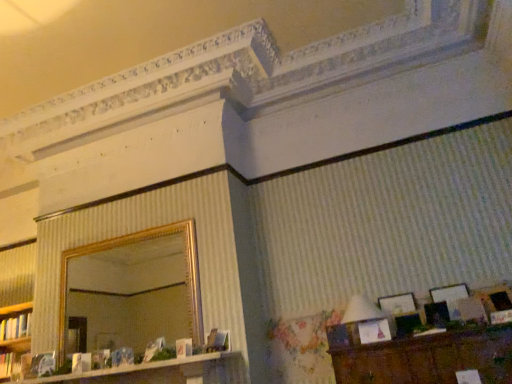
How much space does matte silver picture frame at upper right, which appears as the 1th picture frame when viewed from the left, occupy vertically?

The height of matte silver picture frame at upper right, which appears as the 1th picture frame when viewed from the left, is 28.99 centimeters.

Image resolution: width=512 pixels, height=384 pixels. In order to click on matte silver picture frame at upper right, acting as the third picture frame starting from the right in this screenshot , I will do `click(398, 304)`.

This screenshot has height=384, width=512. What do you see at coordinates (14, 365) in the screenshot? I see `matte white book at lower left, which appears as the 1th book when ordered from the bottom` at bounding box center [14, 365].

What do you see at coordinates (450, 297) in the screenshot?
I see `matte black picture frame at lower right, arranged as the 2th picture frame when viewed from the right` at bounding box center [450, 297].

The image size is (512, 384). In order to click on white paper book at left, which is the 2th book in bottom-to-top order in this screenshot , I will do `click(15, 327)`.

Between matte black picture frame at lower right, arranged as the 2th picture frame when viewed from the left, and white glossy dresser at lower left, which one appears on the right side from the viewer's perspective?

matte black picture frame at lower right, arranged as the 2th picture frame when viewed from the left, is more to the right.

Is matte black picture frame at lower right, arranged as the 2th picture frame when viewed from the right, aimed at white glossy dresser at lower left?

No.

How different are the orientations of matte black picture frame at lower right, arranged as the 2th picture frame when viewed from the right, and white glossy dresser at lower left in degrees?

There is a 1.01-degree angle between the facing directions of matte black picture frame at lower right, arranged as the 2th picture frame when viewed from the right, and white glossy dresser at lower left.

Locate an element on the screen. The height and width of the screenshot is (384, 512). the 2nd picture frame above when counting from the white glossy dresser at lower left (from the image's perspective) is located at coordinates (450, 297).

From a real-world perspective, is brown wooden vanity at lower right physically located above or below white fabric lampshade at right?

brown wooden vanity at lower right is below white fabric lampshade at right.

Is point (426, 383) positioned after point (350, 335)?

No.

Does brown wooden vanity at lower right appear on the left side of white fabric lampshade at right?

Incorrect, brown wooden vanity at lower right is not on the left side of white fabric lampshade at right.

Considering the relative sizes of brown wooden vanity at lower right and white fabric lampshade at right in the image provided, is brown wooden vanity at lower right taller than white fabric lampshade at right?

Yes, brown wooden vanity at lower right is taller than white fabric lampshade at right.

Relative to matte black picture frame at lower right, arranged as the 2th picture frame when viewed from the left, is matte white book at lower left, the 2th book from the top, in front or behind?

Clearly, matte white book at lower left, the 2th book from the top, is behind matte black picture frame at lower right, arranged as the 2th picture frame when viewed from the left.

Considering the positions of objects matte white book at lower left, the 2th book from the top, and matte black picture frame at lower right, arranged as the 2th picture frame when viewed from the left, in the image provided, who is more to the left, matte white book at lower left, the 2th book from the top, or matte black picture frame at lower right, arranged as the 2th picture frame when viewed from the left,?

matte white book at lower left, the 2th book from the top, is more to the left.

Is matte black picture frame at lower right, arranged as the 2th picture frame when viewed from the left, surrounded by matte white book at lower left, the 2th book from the top?

Definitely not — matte black picture frame at lower right, arranged as the 2th picture frame when viewed from the left, is not inside matte white book at lower left, the 2th book from the top.

Does point (4, 357) come closer to viewer compared to point (463, 287)?

No, it is behind (463, 287).

Which object is positioned more to the left, white glossy dresser at lower left or matte white book at lower left, which appears as the 1th book when ordered from the bottom?

matte white book at lower left, which appears as the 1th book when ordered from the bottom.

Is white glossy dresser at lower left closer to camera compared to matte white book at lower left, which appears as the 1th book when ordered from the bottom?

Yes, white glossy dresser at lower left is in front of matte white book at lower left, which appears as the 1th book when ordered from the bottom.

Between white glossy dresser at lower left and matte white book at lower left, the 2th book from the top, which one has smaller size?

Smaller between the two is matte white book at lower left, the 2th book from the top.

Could you tell me if white fabric lampshade at right is turned towards matte black picture frame at lower right, arranged as the 2th picture frame when viewed from the right?

No.

Is white fabric lampshade at right far from matte black picture frame at lower right, arranged as the 2th picture frame when viewed from the left?

No, there isn't a large distance between white fabric lampshade at right and matte black picture frame at lower right, arranged as the 2th picture frame when viewed from the left.

From the image's perspective, is white fabric lampshade at right beneath matte black picture frame at lower right, arranged as the 2th picture frame when viewed from the left?

Yes, from the image's perspective, white fabric lampshade at right is below matte black picture frame at lower right, arranged as the 2th picture frame when viewed from the left.

In the image, is white fabric lampshade at right positioned in front of or behind matte black picture frame at lower right, arranged as the 2th picture frame when viewed from the left?

white fabric lampshade at right is in front of matte black picture frame at lower right, arranged as the 2th picture frame when viewed from the left.

Between wooden picture frame at lower right, arranged as the 3th picture frame when viewed from the left, and gold-framed mirror at upper center, which one has smaller size?

wooden picture frame at lower right, arranged as the 3th picture frame when viewed from the left, is smaller.

From the picture: From the image's perspective, which object appears higher, wooden picture frame at lower right, arranged as the 3th picture frame when viewed from the left, or gold-framed mirror at upper center?

wooden picture frame at lower right, arranged as the 3th picture frame when viewed from the left.

Is gold-framed mirror at upper center at the back of wooden picture frame at lower right, positioned as the first picture frame in right-to-left order?

No, gold-framed mirror at upper center is not at the back of wooden picture frame at lower right, positioned as the first picture frame in right-to-left order.

Would you consider wooden picture frame at lower right, positioned as the first picture frame in right-to-left order, to be distant from gold-framed mirror at upper center?

wooden picture frame at lower right, positioned as the first picture frame in right-to-left order, is far away from gold-framed mirror at upper center.

Between point (8, 329) and point (501, 289), which one is positioned behind?

The point (8, 329) is farther.

Does white paper book at left, the first book in the top-to-bottom sequence, have a greater height compared to wooden picture frame at lower right, arranged as the 3th picture frame when viewed from the left?

In fact, white paper book at left, the first book in the top-to-bottom sequence, may be shorter than wooden picture frame at lower right, arranged as the 3th picture frame when viewed from the left.

From a real-world perspective, which is physically above, white paper book at left, the first book in the top-to-bottom sequence, or wooden picture frame at lower right, arranged as the 3th picture frame when viewed from the left?

white paper book at left, the first book in the top-to-bottom sequence, is physically above.

At what (x,y) coordinates should I click in order to perform the action: click on the 3rd picture frame counting from the right of the white paper book at left, the first book in the top-to-bottom sequence. Please return your answer as a coordinate pair (x, y). Looking at the image, I should click on (495, 299).

Find the location of `dresser that appears below the matte black picture frame at lower right, arranged as the 2th picture frame when viewed from the right (from the image's perspective)`. dresser that appears below the matte black picture frame at lower right, arranged as the 2th picture frame when viewed from the right (from the image's perspective) is located at coordinates (140, 368).

This screenshot has height=384, width=512. What are the coordinates of `table lamp on the left side of brown wooden vanity at lower right` in the screenshot? It's located at (360, 314).

From the image, which object appears to be nearer to white glossy dresser at lower left, white paper book at left, which is the 2th book in bottom-to-top order, or matte silver picture frame at upper right, acting as the third picture frame starting from the right?

white paper book at left, which is the 2th book in bottom-to-top order, is closer to white glossy dresser at lower left.

When comparing their distances from matte white book at lower left, the 2th book from the top, does white glossy dresser at lower left or matte black picture frame at lower right, arranged as the 2th picture frame when viewed from the left, seem further?

Based on the image, matte black picture frame at lower right, arranged as the 2th picture frame when viewed from the left, appears to be further to matte white book at lower left, the 2th book from the top.

Looking at the image, which one is located closer to gold-framed mirror at upper center, matte silver picture frame at upper right, which appears as the 1th picture frame when viewed from the left, or matte black picture frame at lower right, arranged as the 2th picture frame when viewed from the left?

matte silver picture frame at upper right, which appears as the 1th picture frame when viewed from the left, lies closer to gold-framed mirror at upper center than the other object.

From the image, which object appears to be farther from matte silver picture frame at upper right, which appears as the 1th picture frame when viewed from the left, matte black picture frame at lower right, arranged as the 2th picture frame when viewed from the left, or white paper book at left, which is the 2th book in bottom-to-top order?

white paper book at left, which is the 2th book in bottom-to-top order, lies further to matte silver picture frame at upper right, which appears as the 1th picture frame when viewed from the left, than the other object.

Based on their spatial positions, is matte silver picture frame at upper right, which appears as the 1th picture frame when viewed from the left, or white glossy dresser at lower left closer to brown wooden vanity at lower right?

matte silver picture frame at upper right, which appears as the 1th picture frame when viewed from the left, lies closer to brown wooden vanity at lower right than the other object.

Considering their positions, is wooden picture frame at lower right, arranged as the 3th picture frame when viewed from the left, positioned closer to white glossy dresser at lower left than gold-framed mirror at upper center?

Based on the image, gold-framed mirror at upper center appears to be nearer to white glossy dresser at lower left.

When comparing their distances from wooden picture frame at lower right, positioned as the first picture frame in right-to-left order, does matte white book at lower left, the 2th book from the top, or white paper book at left, which is the 2th book in bottom-to-top order, seem closer?

matte white book at lower left, the 2th book from the top.

Considering their positions, is matte black picture frame at lower right, arranged as the 2th picture frame when viewed from the right, positioned further to matte white book at lower left, which appears as the 1th book when ordered from the bottom, than white fabric lampshade at right?

The object further to matte white book at lower left, which appears as the 1th book when ordered from the bottom, is matte black picture frame at lower right, arranged as the 2th picture frame when viewed from the right.

Identify the location of table lamp between white paper book at left, which is the 2th book in bottom-to-top order, and matte black picture frame at lower right, arranged as the 2th picture frame when viewed from the right, from left to right. The height and width of the screenshot is (384, 512). (360, 314).

Locate an element on the screen. The image size is (512, 384). vanity between matte white book at lower left, the 2th book from the top, and matte black picture frame at lower right, arranged as the 2th picture frame when viewed from the left, in the horizontal direction is located at coordinates (428, 358).

This screenshot has width=512, height=384. In order to click on picture frame between white glossy dresser at lower left and matte black picture frame at lower right, arranged as the 2th picture frame when viewed from the left in this screenshot , I will do `click(398, 304)`.

This screenshot has height=384, width=512. In order to click on picture frame situated between gold-framed mirror at upper center and matte black picture frame at lower right, arranged as the 2th picture frame when viewed from the left, from left to right in this screenshot , I will do `click(398, 304)`.